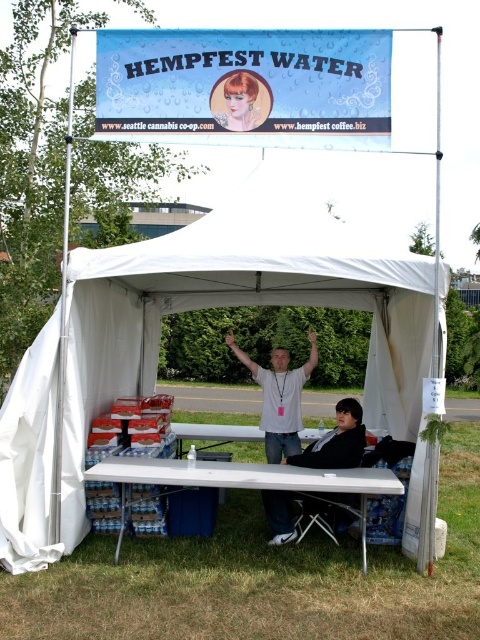
Does black fabric jacket at lower center have a lesser height compared to smooth plastic face at upper center?

No, black fabric jacket at lower center is not shorter than smooth plastic face at upper center.

Does black fabric jacket at lower center appear on the left side of smooth plastic face at upper center?

In fact, black fabric jacket at lower center is to the right of smooth plastic face at upper center.

Who is more distant from viewer, (314, 452) or (259, 116)?

Positioned behind is point (314, 452).

Where is `black fabric jacket at lower center`? The width and height of the screenshot is (480, 640). black fabric jacket at lower center is located at coordinates (336, 442).

Can you confirm if white plastic picnic table at lower center is smaller than white t-shirt at center?

Incorrect, white plastic picnic table at lower center is not smaller in size than white t-shirt at center.

Is point (96, 468) farther from viewer compared to point (288, 400)?

No, it is in front of (288, 400).

Is point (218, 483) behind point (263, 420)?

No, (218, 483) is in front of (263, 420).

Locate an element on the screen. white plastic picnic table at lower center is located at coordinates (250, 483).

Does white t-shirt at center have a lesser width compared to black fabric jacket at lower center?

Yes, white t-shirt at center is thinner than black fabric jacket at lower center.

Is point (312, 362) positioned before point (324, 440)?

No, it is behind (324, 440).

Where is `white t-shirt at center`? white t-shirt at center is located at coordinates (279, 397).